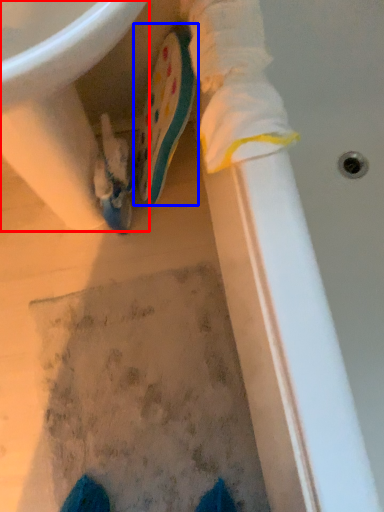
Question: Which object is closer to the camera taking this photo, sink (highlighted by a red box) or footwear (highlighted by a blue box)?

Choices:
 (A) sink
 (B) footwear

Answer: (A)